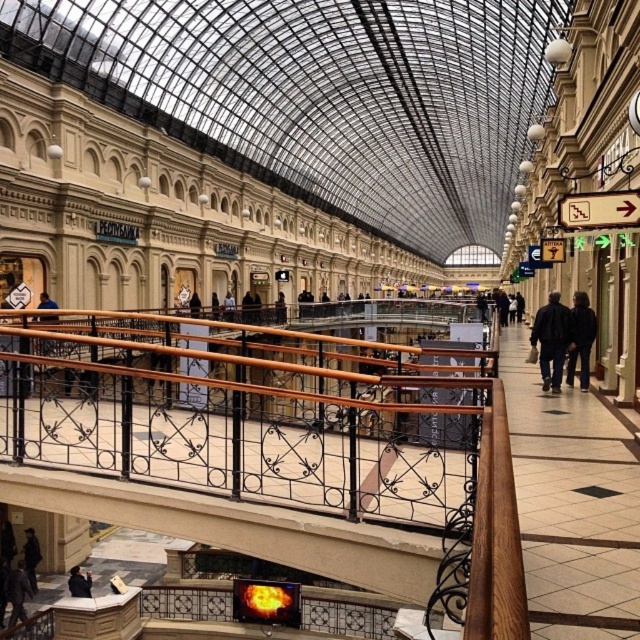
You are a customer in the shopping arcade and want to buy a jacket. You see the dark blue jacket at center and the matte black jacket at lower left. Which jacket is closer to the floor?

The dark blue jacket at center is closer to the floor because it is located below the matte black jacket at lower left.